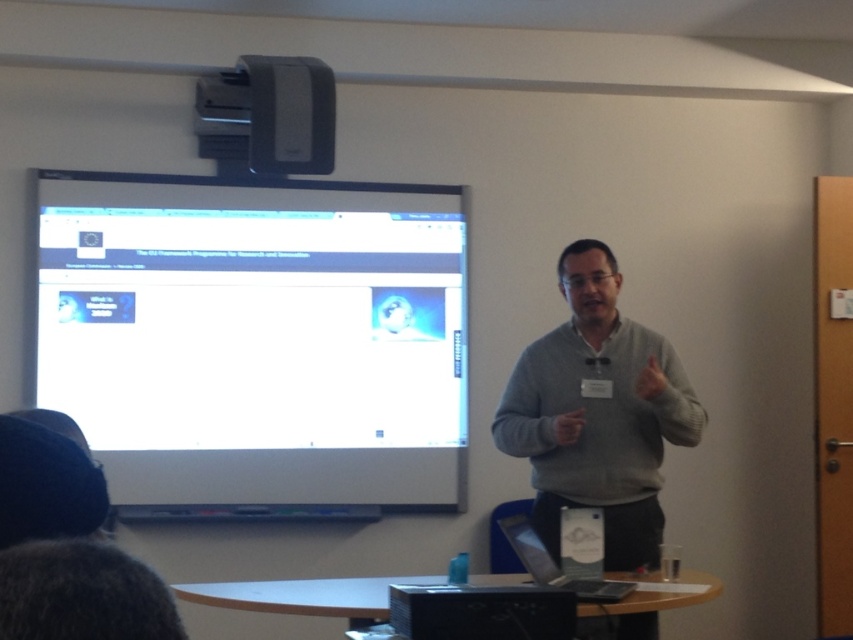
You are an attendee at the presentation. You want to take a photo of the projector and the screen. The photographer told you that the matte gray projector at upper center must be in the same frame as the white glossy projection screen at upper left. Is this possible?

The matte gray projector at upper center is behind the white glossy projection screen at upper left, so yes, you can take a photo where both are visible in the same frame.